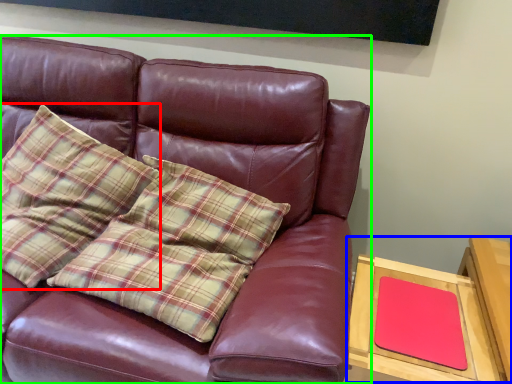
Question: Which object is positioned closest to pillow (highlighted by a red box)? Select from table (highlighted by a blue box) and studio couch (highlighted by a green box).

Choices:
 (A) table
 (B) studio couch

Answer: (B)